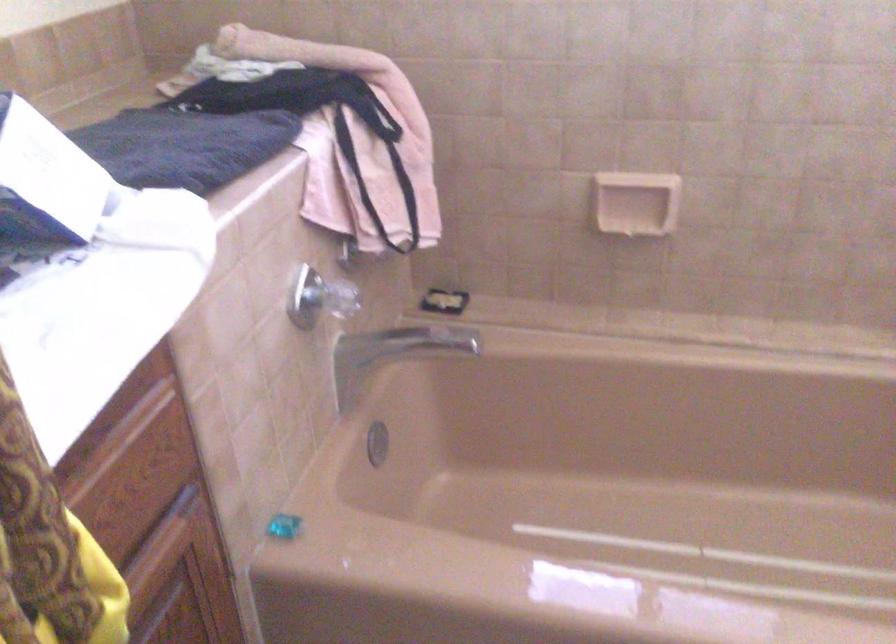
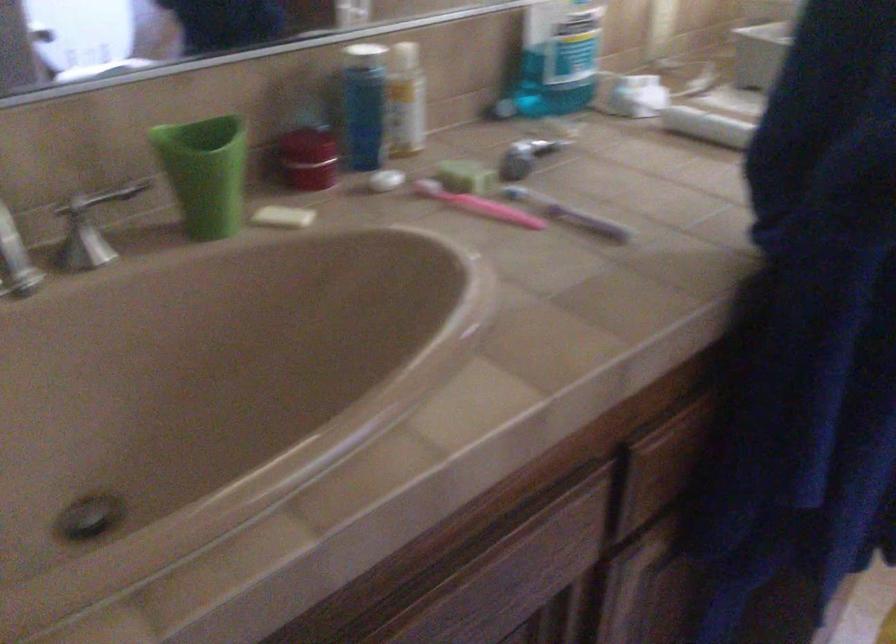
Question: How did the camera likely rotate?

Choices:
 (A) Left
 (B) Right
 (C) Up
 (D) Down

Answer: (A)